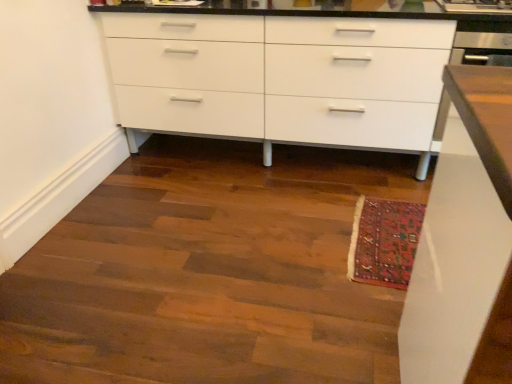
Identify the location of empty space that is ontop of carpeted mat at lower right (from a real-world perspective). The height and width of the screenshot is (384, 512). (391, 232).